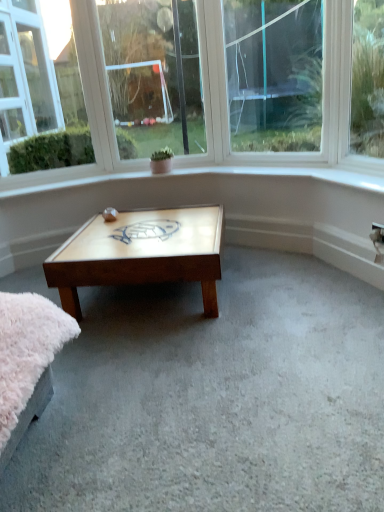
I want to click on vacant point above wooden turtle design at center (from a real-world perspective), so click(x=151, y=221).